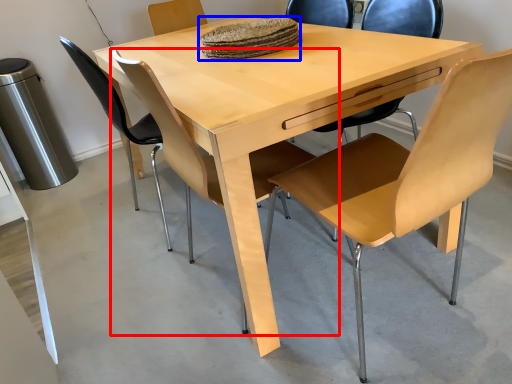
Question: Which object appears farthest to the camera in this image, chair (highlighted by a red box) or food (highlighted by a blue box)?

Choices:
 (A) chair
 (B) food

Answer: (B)